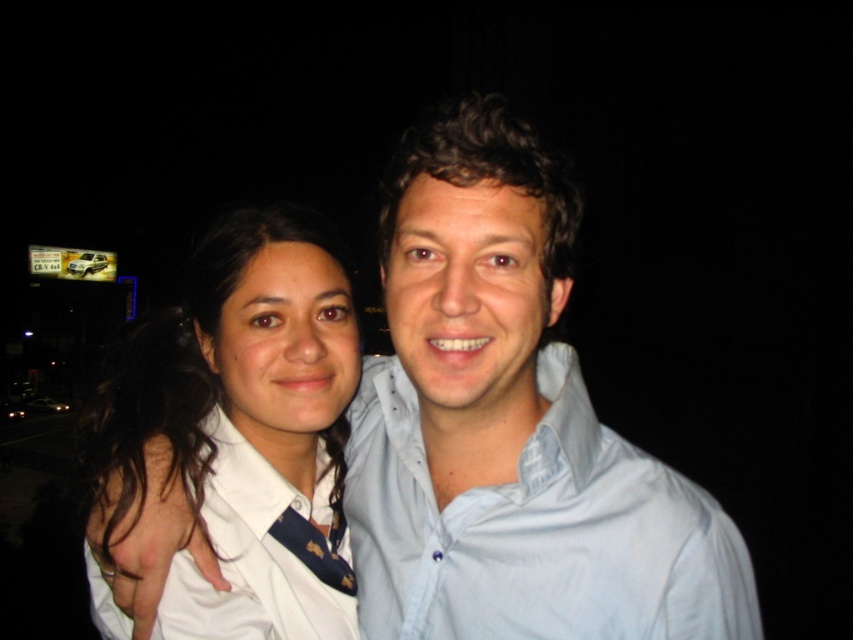
Question: Can you confirm if light blue cotton shirt at center is wider than white shirt at center?

Choices:
 (A) no
 (B) yes

Answer: (B)

Question: Which object is the farthest from the white shirt at center?

Choices:
 (A) light blue cotton shirt at center
 (B) blue silk tie at center

Answer: (A)

Question: Which of these objects is positioned closest to the light blue cotton shirt at center?

Choices:
 (A) white shirt at center
 (B) blue silk tie at center

Answer: (A)

Question: Which point is farther to the camera?

Choices:
 (A) pyautogui.click(x=264, y=461)
 (B) pyautogui.click(x=317, y=540)
 (C) pyautogui.click(x=556, y=529)

Answer: (B)

Question: Does light blue cotton shirt at center come in front of white shirt at center?

Choices:
 (A) yes
 (B) no

Answer: (A)

Question: Is light blue cotton shirt at center thinner than white shirt at center?

Choices:
 (A) yes
 (B) no

Answer: (B)